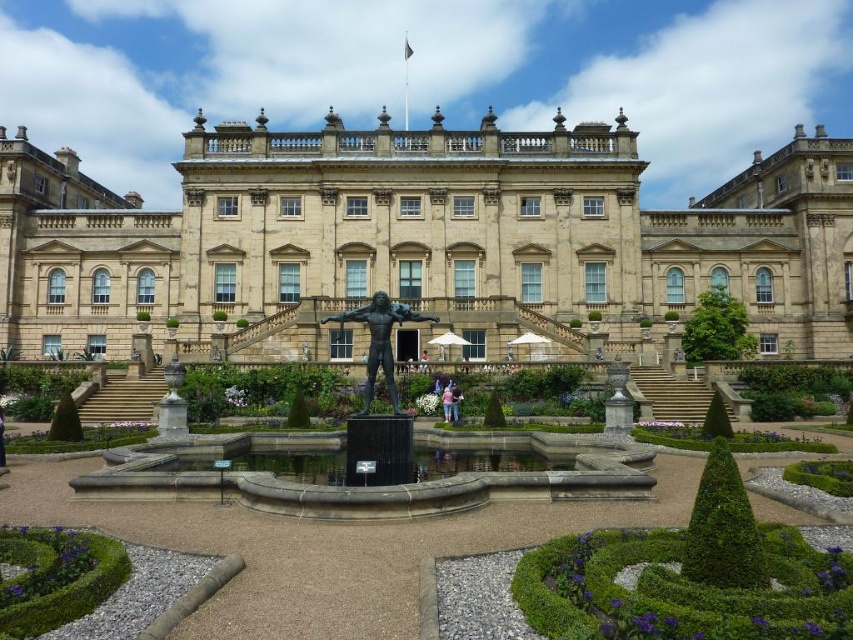
The width and height of the screenshot is (853, 640). Describe the element at coordinates (369, 474) in the screenshot. I see `black polished stone fountain at center` at that location.

Who is more distant from viewer, (332, 500) or (451, 392)?

Point (451, 392)

Is point (161, 468) positioned before point (453, 403)?

Yes, it is in front of point (453, 403).

Locate an element on the screen. This screenshot has height=640, width=853. black polished stone fountain at center is located at coordinates (369, 474).

Looking at this image, does bronze statue at center have a larger size compared to pink fabric person at center?

Yes.

Where is `bronze statue at center`? bronze statue at center is located at coordinates (379, 340).

Is point (450, 387) behind point (445, 406)?

That is True.

Between pink fabric person at center and light blue denim jeans at center, which one appears on the left side from the viewer's perspective?

From the viewer's perspective, light blue denim jeans at center appears more on the left side.

Is point (451, 401) in front of point (450, 406)?

No, it is not.

Where is `pink fabric person at center`? pink fabric person at center is located at coordinates (456, 403).